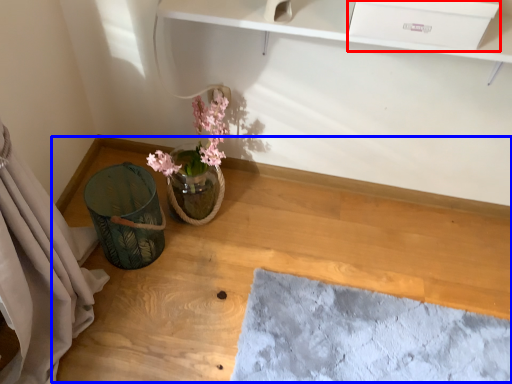
Question: Which object is further to the camera taking this photo, drawer (highlighted by a red box) or table (highlighted by a blue box)?

Choices:
 (A) drawer
 (B) table

Answer: (B)